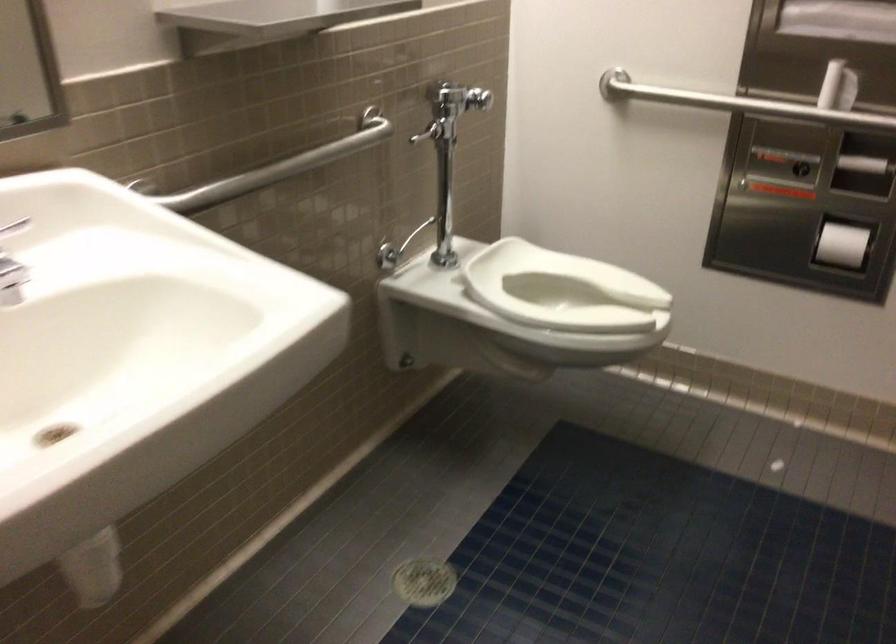
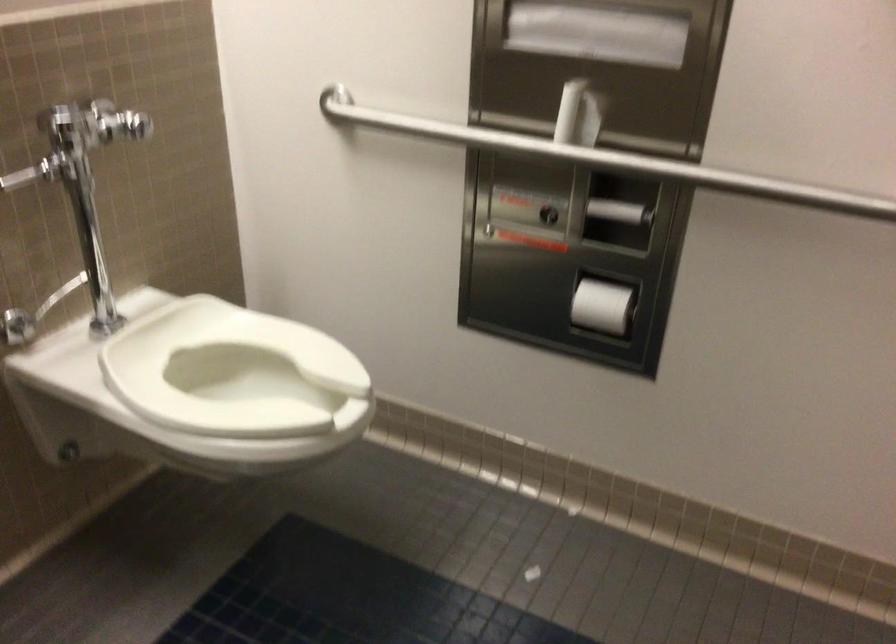
In a continuous first-person perspective shot, in which direction is the camera moving?

The cameraman walked toward right, forward.